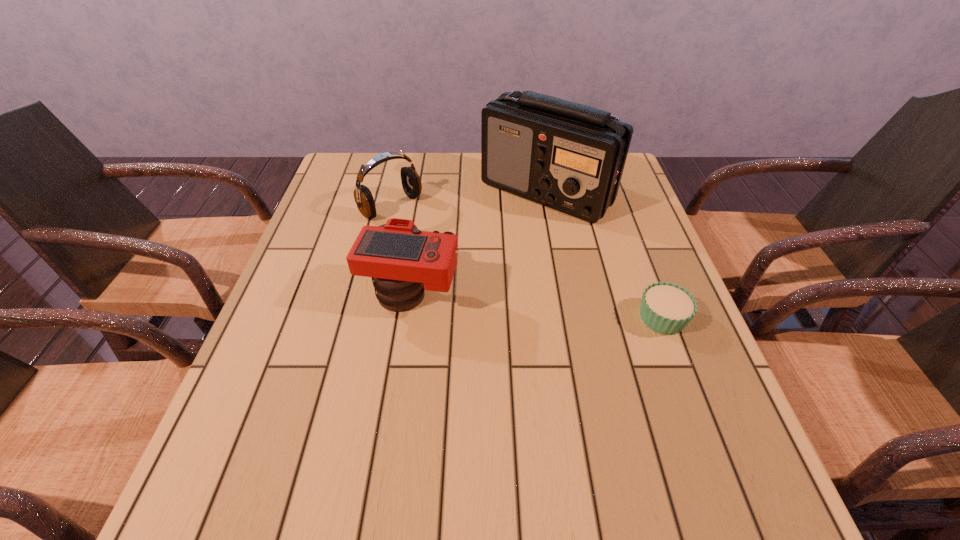
Identify the location of free location located on the front panel of the tallest object. This screenshot has height=540, width=960. (549, 267).

Identify the location of free point located on the front panel of the tallest object. (548, 261).

Find the location of a particular element. The image size is (960, 540). headset located at the far edge is located at coordinates (411, 182).

In order to click on radio receiver that is at the far edge in this screenshot , I will do `click(570, 157)`.

Where is `object present at the left edge`? This screenshot has height=540, width=960. object present at the left edge is located at coordinates (411, 182).

In order to click on cupcake present at the right edge in this screenshot , I will do `click(666, 308)`.

The image size is (960, 540). I want to click on radio receiver located at the right edge, so click(x=570, y=157).

Locate an element on the screen. The height and width of the screenshot is (540, 960). object that is at the far left corner is located at coordinates (411, 182).

Where is `object positioned at the far right corner`? This screenshot has height=540, width=960. object positioned at the far right corner is located at coordinates (570, 157).

The height and width of the screenshot is (540, 960). I want to click on vacant space at the far edge of the desktop, so click(x=501, y=194).